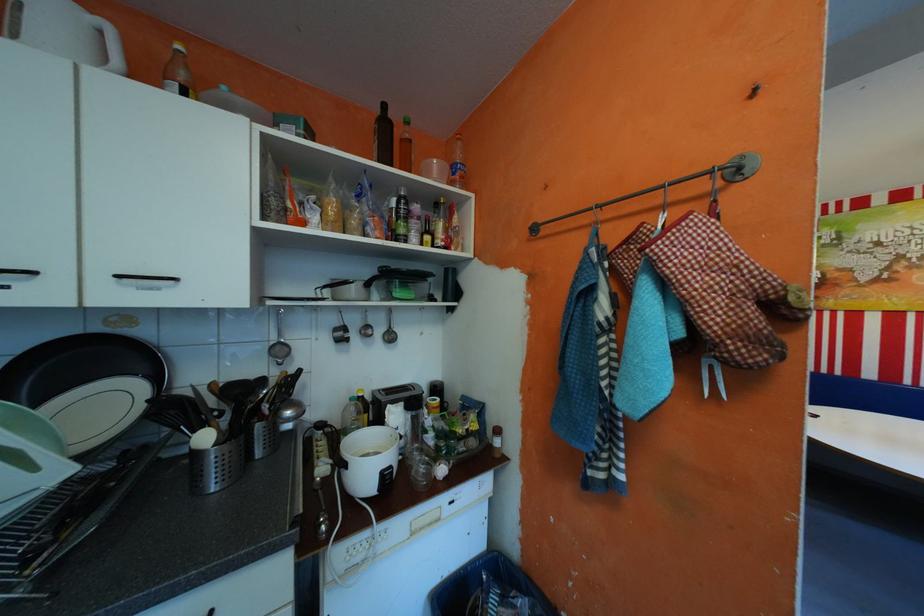
Find the location of a particular element. Image resolution: width=924 pixels, height=616 pixels. rice cooker lid is located at coordinates (86, 385).